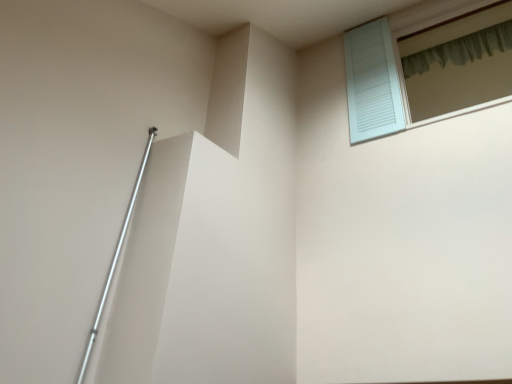
Where is `green fabric shower curtain at upper right`? green fabric shower curtain at upper right is located at coordinates (461, 49).

Describe the element at coordinates (461, 49) in the screenshot. I see `green fabric shower curtain at upper right` at that location.

At what (x,y) coordinates should I click in order to perform the action: click on light blue wooden window at upper right. Please return your answer as a coordinate pair (x, y). Looking at the image, I should click on (426, 72).

The height and width of the screenshot is (384, 512). What do you see at coordinates (426, 72) in the screenshot? I see `light blue wooden window at upper right` at bounding box center [426, 72].

Identify the location of green fabric shower curtain at upper right. The width and height of the screenshot is (512, 384). (461, 49).

Which object is positioned more to the right, green fabric shower curtain at upper right or light blue wooden window at upper right?

green fabric shower curtain at upper right is more to the right.

Which is in front, green fabric shower curtain at upper right or light blue wooden window at upper right?

light blue wooden window at upper right is more forward.

Is point (499, 45) more distant than point (496, 83)?

That is False.

From the image's perspective, is green fabric shower curtain at upper right located beneath light blue wooden window at upper right?

Actually, green fabric shower curtain at upper right appears above light blue wooden window at upper right in the image.

From a real-world perspective, is green fabric shower curtain at upper right on top of light blue wooden window at upper right?

Indeed, from a real-world perspective, green fabric shower curtain at upper right stands above light blue wooden window at upper right.

Between green fabric shower curtain at upper right and light blue wooden window at upper right, which one has smaller width?

green fabric shower curtain at upper right is thinner.

Is green fabric shower curtain at upper right taller or shorter than light blue wooden window at upper right?

green fabric shower curtain at upper right is shorter than light blue wooden window at upper right.

Which of these two, green fabric shower curtain at upper right or light blue wooden window at upper right, is bigger?

With larger size is light blue wooden window at upper right.

Would you say light blue wooden window at upper right is part of green fabric shower curtain at upper right's contents?

No, light blue wooden window at upper right is not inside green fabric shower curtain at upper right.

Is green fabric shower curtain at upper right next to light blue wooden window at upper right and touching it?

No, green fabric shower curtain at upper right is not with light blue wooden window at upper right.

Is green fabric shower curtain at upper right facing towards light blue wooden window at upper right?

Yes, green fabric shower curtain at upper right is aimed at light blue wooden window at upper right.

What's the angular difference between green fabric shower curtain at upper right and light blue wooden window at upper right's facing directions?

The facing directions of green fabric shower curtain at upper right and light blue wooden window at upper right are 0.171 degrees apart.

How much distance is there between green fabric shower curtain at upper right and light blue wooden window at upper right?

green fabric shower curtain at upper right and light blue wooden window at upper right are 9.01 inches apart.

Find the location of `window below the green fabric shower curtain at upper right (from the image's perspective)`. window below the green fabric shower curtain at upper right (from the image's perspective) is located at coordinates (426, 72).

Considering the relative positions of light blue wooden window at upper right and green fabric shower curtain at upper right in the image provided, is light blue wooden window at upper right to the left or to the right of green fabric shower curtain at upper right?

Based on their positions, light blue wooden window at upper right is located to the left of green fabric shower curtain at upper right.

Is light blue wooden window at upper right positioned behind green fabric shower curtain at upper right?

No, light blue wooden window at upper right is closer to the camera.

Based on the photo, which point is more forward, (366, 57) or (493, 39)?

The point (366, 57) is closer to the camera.

From the image's perspective, is light blue wooden window at upper right on green fabric shower curtain at upper right?

No.

From a real-world perspective, between light blue wooden window at upper right and green fabric shower curtain at upper right, who is vertically lower?

light blue wooden window at upper right is physically lower.

Is light blue wooden window at upper right wider than green fabric shower curtain at upper right?

Indeed, light blue wooden window at upper right has a greater width compared to green fabric shower curtain at upper right.

Can you confirm if light blue wooden window at upper right is taller than green fabric shower curtain at upper right?

Yes.

Can you confirm if light blue wooden window at upper right is smaller than green fabric shower curtain at upper right?

Actually, light blue wooden window at upper right might be larger than green fabric shower curtain at upper right.

Would you say green fabric shower curtain at upper right is part of light blue wooden window at upper right's contents?

Actually, green fabric shower curtain at upper right is outside light blue wooden window at upper right.

Is light blue wooden window at upper right far from green fabric shower curtain at upper right?

No, there isn't a large distance between light blue wooden window at upper right and green fabric shower curtain at upper right.

Is light blue wooden window at upper right oriented towards green fabric shower curtain at upper right?

No, light blue wooden window at upper right does not turn towards green fabric shower curtain at upper right.

How many degrees apart are the facing directions of light blue wooden window at upper right and green fabric shower curtain at upper right?

They differ by 0.171 degrees in their facing directions.

Find the location of a particular element. The image size is (512, 384). shower curtain that appears above the light blue wooden window at upper right (from a real-world perspective) is located at coordinates (461, 49).

Identify the location of window on the left of the green fabric shower curtain at upper right. (426, 72).

You are a GUI agent. You are given a task and a screenshot of the screen. Output one action in this format:
    pyautogui.click(x=<x>, y=<y>)
    Task: Click on the shower curtain positioned vertically above the light blue wooden window at upper right (from a real-world perspective)
    This screenshot has width=512, height=384.
    Given the screenshot: What is the action you would take?
    pyautogui.click(x=461, y=49)